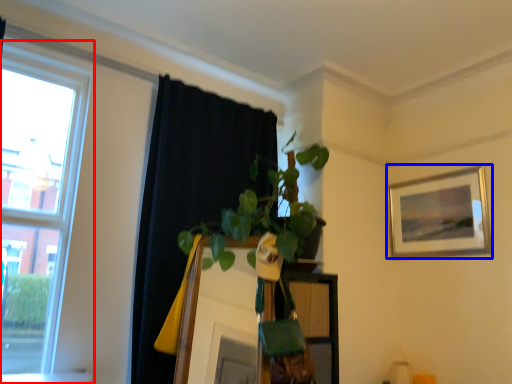
Question: Which object appears farthest to the camera in this image, window (highlighted by a red box) or picture frame (highlighted by a blue box)?

Choices:
 (A) window
 (B) picture frame

Answer: (B)